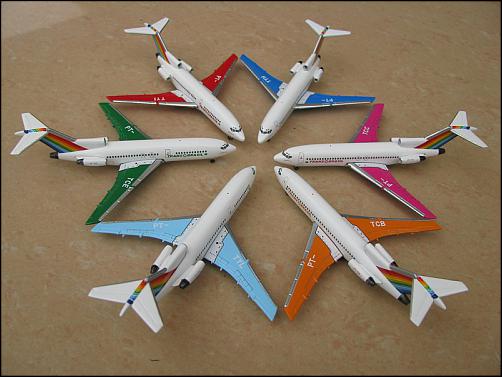
At what (x,y) coordinates should I click in order to perform the action: click on doors. Please return your answer as a coordinate pair (x, y). Looking at the image, I should click on (303, 157), (285, 180), (276, 124).